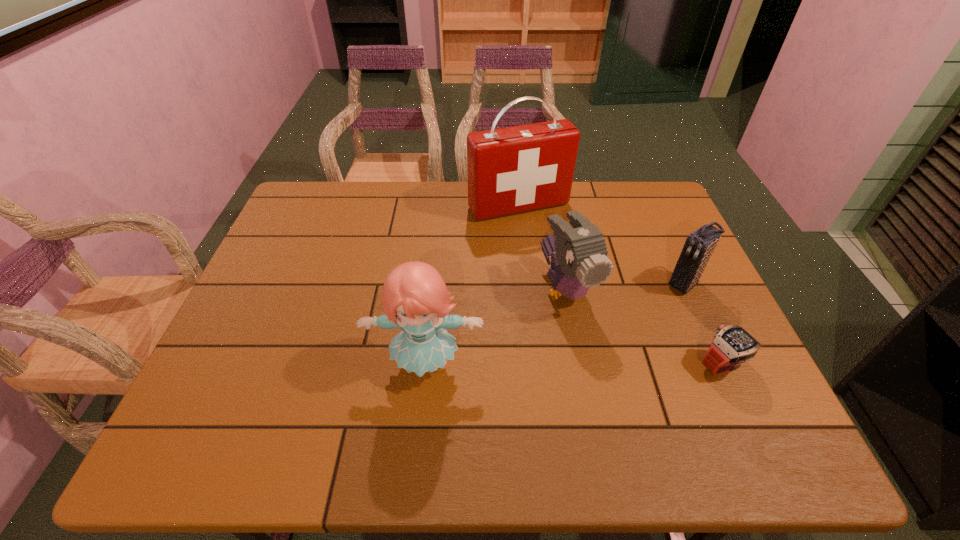
Image resolution: width=960 pixels, height=540 pixels. Identify the location of doll. pyautogui.click(x=415, y=291).

Identify the location of watch. (733, 345).

Locate an element on the screen. This screenshot has height=540, width=960. the first-aid kit is located at coordinates [x=510, y=170].

Find the location of `the farthest object`. the farthest object is located at coordinates (510, 170).

This screenshot has width=960, height=540. Find the location of `bird`. bird is located at coordinates (580, 262).

Locate an element on the screen. This screenshot has width=960, height=540. clutch bag is located at coordinates (698, 248).

Where is `vacant space located 0.170m on the left of the shortest object`? The height and width of the screenshot is (540, 960). vacant space located 0.170m on the left of the shortest object is located at coordinates click(620, 364).

The image size is (960, 540). Find the location of `vacant area situated 0.240m on the front face of the farthest object`. vacant area situated 0.240m on the front face of the farthest object is located at coordinates click(569, 275).

The height and width of the screenshot is (540, 960). I want to click on vacant space positioned on the front face of the farthest object, so click(x=558, y=256).

Locate an element on the screen. The height and width of the screenshot is (540, 960). free space located on the front face of the farthest object is located at coordinates (576, 285).